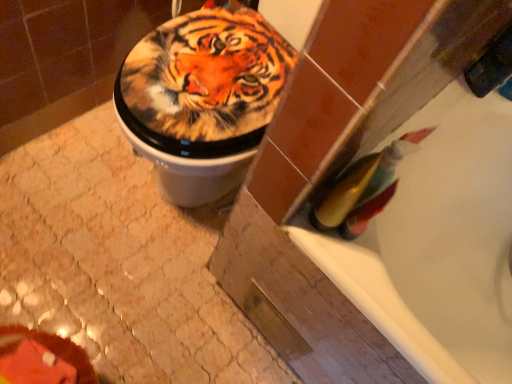
The height and width of the screenshot is (384, 512). What do you see at coordinates (439, 245) in the screenshot?
I see `white glossy bath at lower right` at bounding box center [439, 245].

This screenshot has width=512, height=384. In order to click on white glossy bath at lower right in this screenshot , I will do `click(439, 245)`.

Where is `white glossy bath at lower right`? The width and height of the screenshot is (512, 384). white glossy bath at lower right is located at coordinates (439, 245).